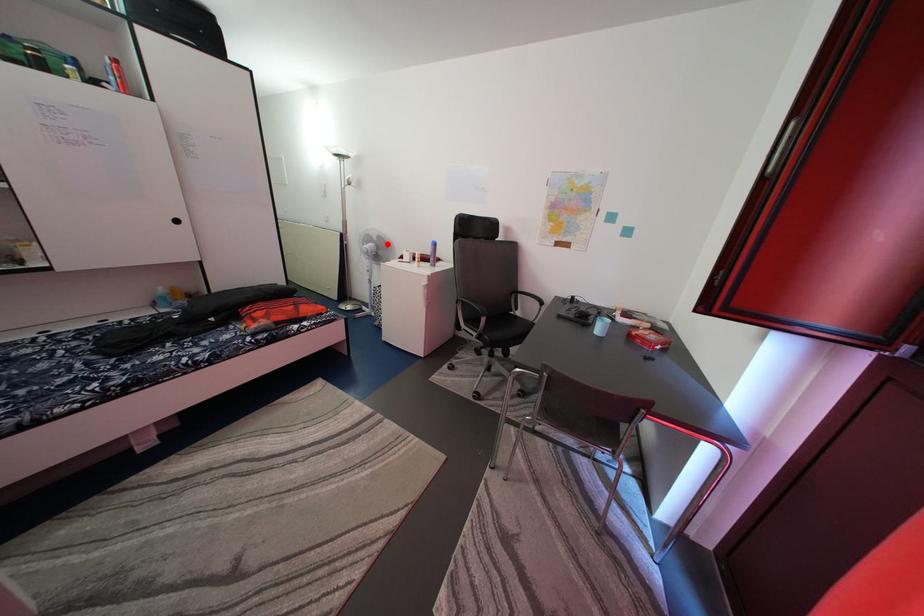
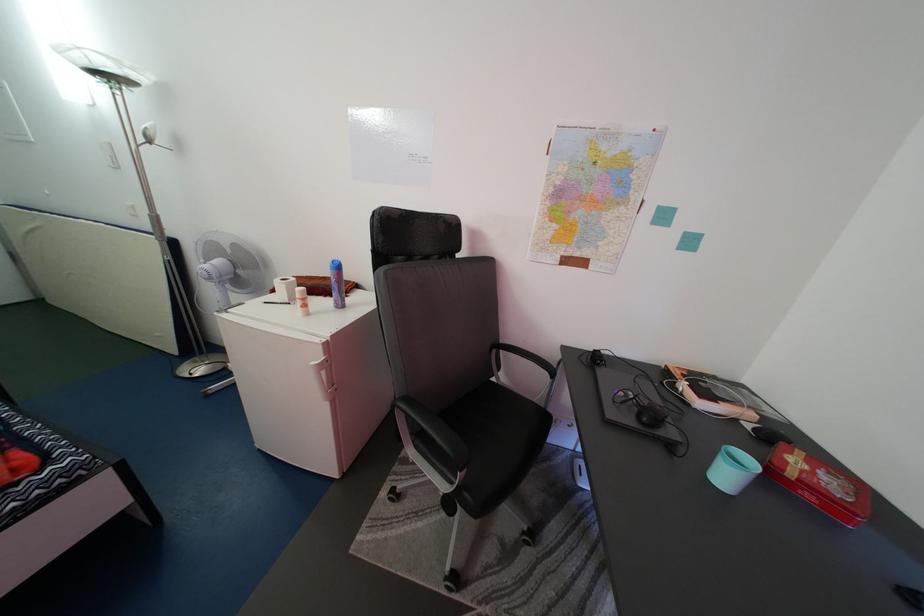
Locate, in the second image, the point that corresponds to the highlighted location in the first image.

(244, 253)